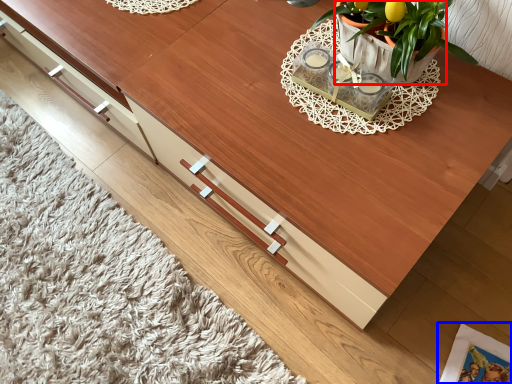
Question: Which of the following is the closest to the observer, flowerpot (highlighted by a red box) or magazine (highlighted by a blue box)?

Choices:
 (A) flowerpot
 (B) magazine

Answer: (A)